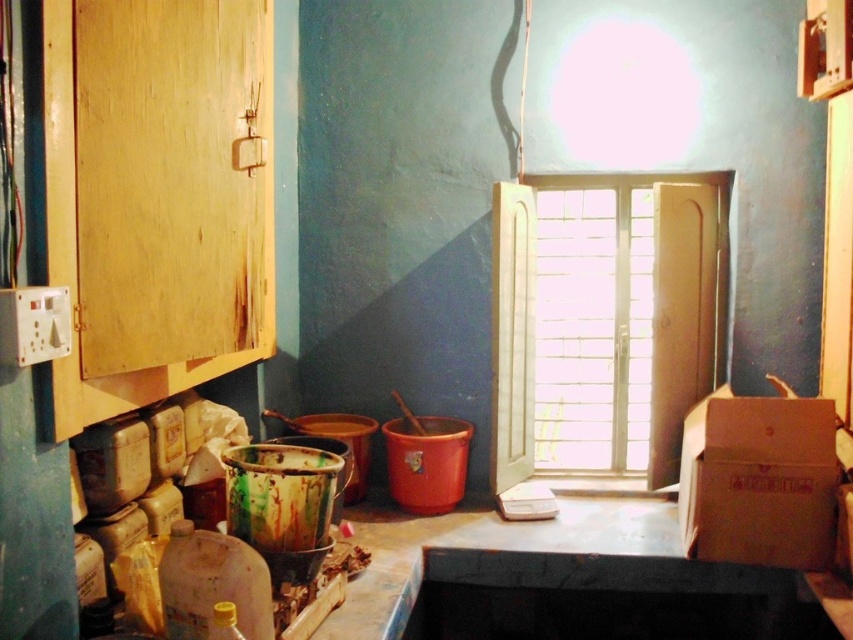
You are organizing items in the utility room and need to place a heavy item on a surface. Which object between the wooden window at center and the brown cardboard box at right can you place it on?

The brown cardboard box at right is a solid surface, while the wooden window at center is not a surface. You can place the heavy item on the brown cardboard box at right.

You are organizing items in the utility room and need to place a new item between the wooden window at center and the brown cardboard box at right. Based on their positions, where should you place it?

The wooden window at center is to the left of the brown cardboard box at right, so you should place the new item between them on the side closer to the brown cardboard box at right.

You are a delivery person who just arrived at this utility room. You need to place a large package on the floor. The wooden window at center is in your way. Can you move the brown cardboard box at right to make space?

The wooden window at center is taller than the brown cardboard box at right, so moving the brown cardboard box at right would free up space below the window. Since the window is taller, the area below it might be obstructed by the window itself. However, moving the box could create space next to or around the window for placing the package.